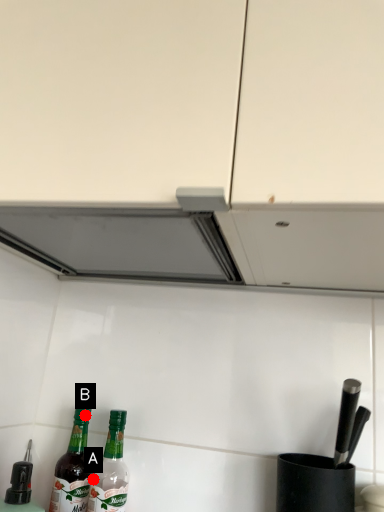
Question: Two points are circled on the image, labeled by A and B beside each circle. Which of the following is the closest to the observer?

Choices:
 (A) A is closer
 (B) B is closer

Answer: (B)